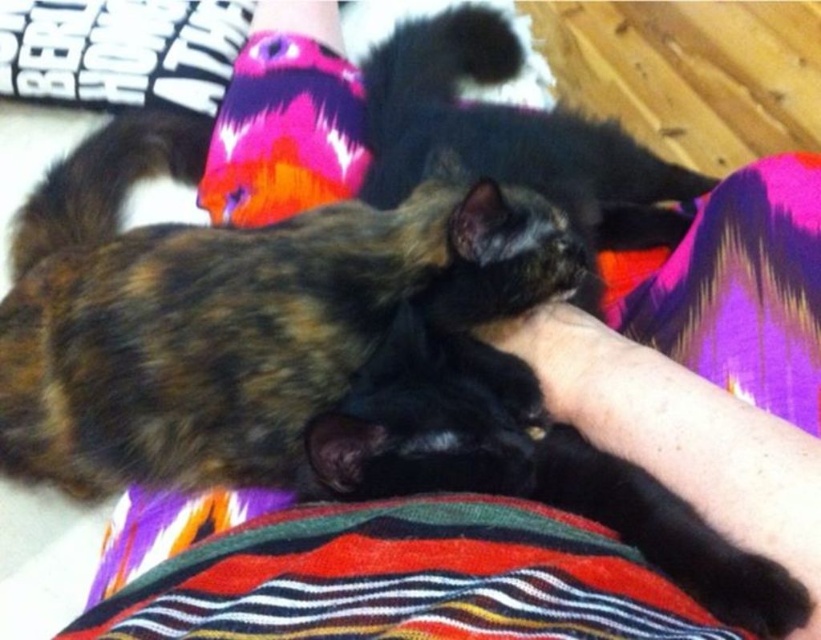
You are a photographer trying to capture a closeup of the brown tortoiseshell cat at center. Based on its position, which part of the person is it closest to?

The brown tortoiseshell cat at center is located at point (242, 321), which places it near the person arm.

You are a cat owner trying to place a new multicolored knitted sock at upper center on the sofa next to the brown tortoiseshell cat at center. Based on their sizes, will the sock fit comfortably next to the cat without overcrowding the space?

The brown tortoiseshell cat at center might be wider than multicolored knitted sock at upper center, so there might not be enough space for both without overcrowding.